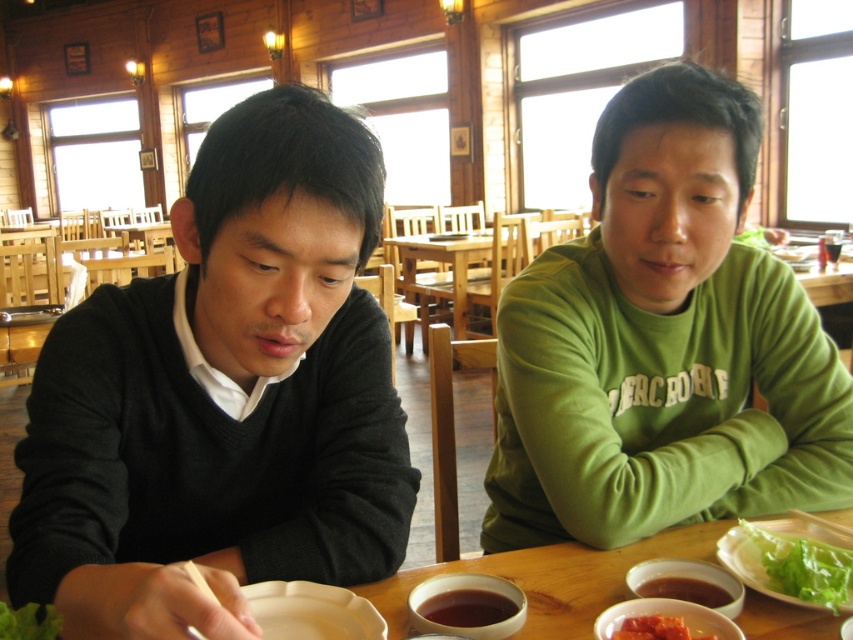
Question: Does green matte shirt at center appear on the left side of white matte plate at lower center?

Choices:
 (A) no
 (B) yes

Answer: (A)

Question: Estimate the real-world distances between objects in this image. Which object is farther from the white matte plate at lower center?

Choices:
 (A) green matte shirt at center
 (B) green leafy lettuce at lower right
 (C) smooth tomato paste at lower center

Answer: (A)

Question: Which point is closer to the camera taking this photo?

Choices:
 (A) (660, 621)
 (B) (830, 600)
 (C) (114, 412)

Answer: (A)

Question: Can you confirm if dark gray sweater at left is positioned to the left of smooth tomato paste at lower center?

Choices:
 (A) no
 (B) yes

Answer: (B)

Question: Is green leafy lettuce at lower right to the left of smooth tomato paste at lower center from the viewer's perspective?

Choices:
 (A) yes
 (B) no

Answer: (B)

Question: Which point is closer to the camera?

Choices:
 (A) (769, 288)
 (B) (827, 600)
 (C) (260, 504)
 (D) (682, 637)

Answer: (D)